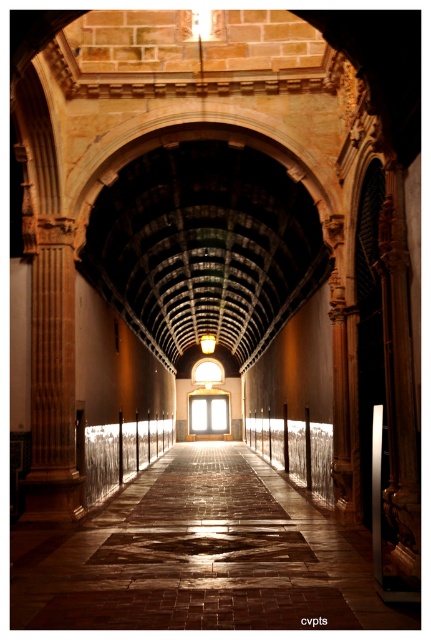
Can you confirm if silver metallic rail at center is thinner than clear glass rail at center?

In fact, silver metallic rail at center might be wider than clear glass rail at center.

Does silver metallic rail at center have a lesser height compared to clear glass rail at center?

In fact, silver metallic rail at center may be taller than clear glass rail at center.

Which is in front, point (149, 426) or point (300, 445)?

Point (300, 445) is more forward.

Identify the location of silver metallic rail at center. Image resolution: width=431 pixels, height=640 pixels. (121, 452).

Between brown stone floor at center and clear glass rail at center, which one appears on the right side from the viewer's perspective?

Positioned to the right is clear glass rail at center.

Identify the location of brown stone floor at center. (199, 556).

The height and width of the screenshot is (640, 431). I want to click on brown stone floor at center, so click(x=199, y=556).

Describe the element at coordinates (53, 380) in the screenshot. The image size is (431, 640). I see `wooden column at left` at that location.

Between wooden column at left and silver metallic rail at center, which one appears on the left side from the viewer's perspective?

Positioned to the left is wooden column at left.

Is point (52, 349) positioned after point (128, 428)?

No.

Image resolution: width=431 pixels, height=640 pixels. What are the coordinates of `wooden column at left` in the screenshot? It's located at (53, 380).